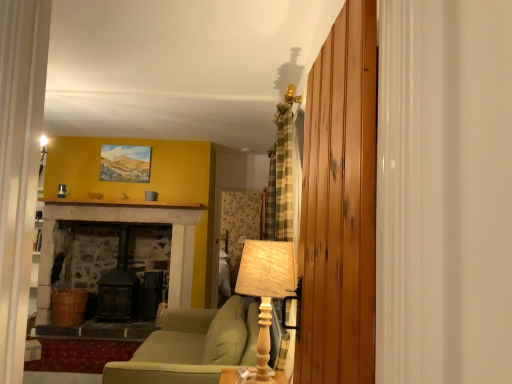
Question: From the image's perspective, is green fabric couch at center over wooden planks at right?

Choices:
 (A) no
 (B) yes

Answer: (A)

Question: Would you say green fabric couch at center is outside wooden planks at right?

Choices:
 (A) yes
 (B) no

Answer: (A)

Question: Considering the relative sizes of green fabric couch at center and wooden planks at right in the image provided, is green fabric couch at center thinner than wooden planks at right?

Choices:
 (A) yes
 (B) no

Answer: (B)

Question: Does green fabric couch at center appear on the right side of wooden planks at right?

Choices:
 (A) no
 (B) yes

Answer: (A)

Question: Can you confirm if green fabric couch at center is smaller than wooden planks at right?

Choices:
 (A) no
 (B) yes

Answer: (A)

Question: From a real-world perspective, does green fabric couch at center sit lower than wooden planks at right?

Choices:
 (A) yes
 (B) no

Answer: (A)

Question: Is wooden planks at right bigger than green fabric couch at center?

Choices:
 (A) no
 (B) yes

Answer: (A)

Question: Is wooden planks at right smaller than green fabric couch at center?

Choices:
 (A) yes
 (B) no

Answer: (A)

Question: Is wooden planks at right placed right next to green fabric couch at center?

Choices:
 (A) no
 (B) yes

Answer: (A)

Question: Is wooden planks at right aimed at green fabric couch at center?

Choices:
 (A) no
 (B) yes

Answer: (A)

Question: From the image's perspective, is wooden planks at right on green fabric couch at center?

Choices:
 (A) no
 (B) yes

Answer: (B)

Question: Is wooden planks at right turned away from green fabric couch at center?

Choices:
 (A) yes
 (B) no

Answer: (B)

Question: Is woven fabric lampshade at right surrounding green fabric couch at center?

Choices:
 (A) yes
 (B) no

Answer: (B)